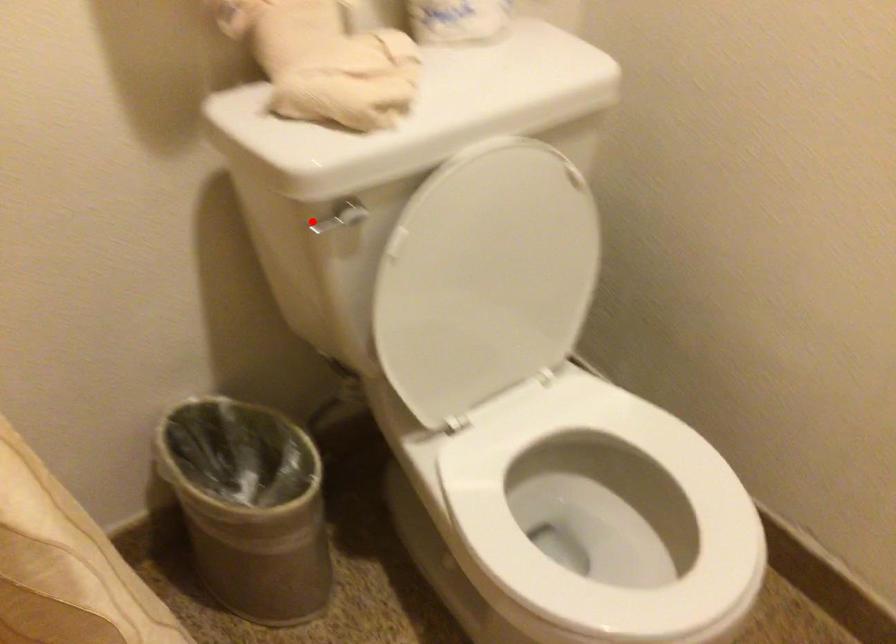
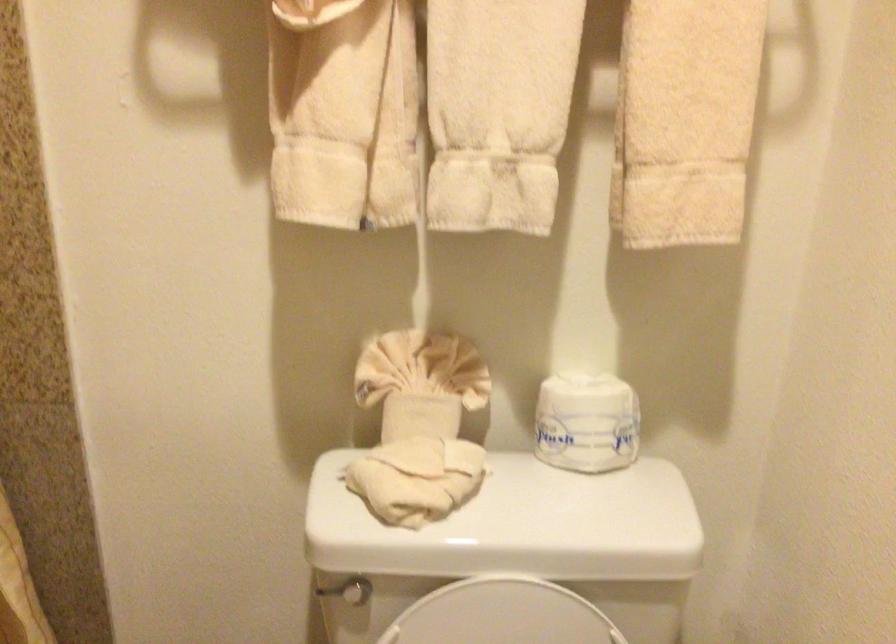
Locate, in the second image, the point that corresponds to the highlighted location in the first image.

(326, 590)